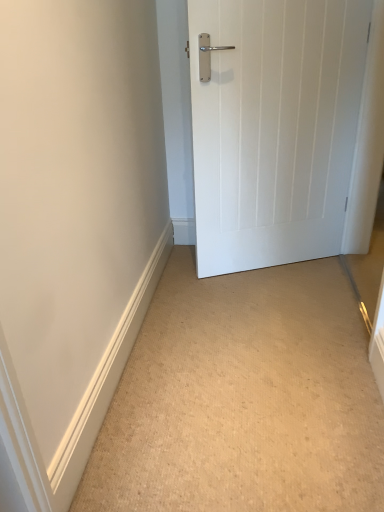
Describe the element at coordinates (274, 128) in the screenshot. I see `white wooden door at right` at that location.

Locate an element on the screen. white wooden door at right is located at coordinates (274, 128).

What do you see at coordinates (243, 398) in the screenshot? The height and width of the screenshot is (512, 384). I see `beige carpet at lower center` at bounding box center [243, 398].

What is the approximate width of beige carpet at lower center?

The width of beige carpet at lower center is 5.19 feet.

Find the location of a particular element. The width and height of the screenshot is (384, 512). beige carpet at lower center is located at coordinates (243, 398).

I want to click on white wooden door at right, so click(x=274, y=128).

Considering the positions of objects white wooden door at right and beige carpet at lower center in the image provided, who is more to the right, white wooden door at right or beige carpet at lower center?

Positioned to the right is white wooden door at right.

Considering the positions of objects white wooden door at right and beige carpet at lower center in the image provided, who is in front, white wooden door at right or beige carpet at lower center?

Positioned in front is beige carpet at lower center.

Does point (358, 73) lie in front of point (308, 377)?

No, it is behind (308, 377).

From the image's perspective, is white wooden door at right located above or below beige carpet at lower center?

white wooden door at right is above beige carpet at lower center.

From a real-world perspective, which is physically below, white wooden door at right or beige carpet at lower center?

beige carpet at lower center, from a real-world perspective.

From the picture: Does white wooden door at right have a greater width compared to beige carpet at lower center?

No, white wooden door at right is not wider than beige carpet at lower center.

Can you confirm if white wooden door at right is shorter than beige carpet at lower center?

No.

Is white wooden door at right smaller than beige carpet at lower center?

Incorrect, white wooden door at right is not smaller in size than beige carpet at lower center.

Is beige carpet at lower center inside white wooden door at right?

Actually, beige carpet at lower center is outside white wooden door at right.

Are white wooden door at right and beige carpet at lower center far apart?

No.

Could you tell me if white wooden door at right is turned towards beige carpet at lower center?

Yes, white wooden door at right is oriented towards beige carpet at lower center.

What are the coordinates of `door above the beige carpet at lower center (from a real-world perspective)` in the screenshot? It's located at (274, 128).

Is beige carpet at lower center to the right of white wooden door at right from the viewer's perspective?

Incorrect, beige carpet at lower center is not on the right side of white wooden door at right.

Is beige carpet at lower center in front of or behind white wooden door at right in the image?

Clearly, beige carpet at lower center is in front of white wooden door at right.

Does point (144, 456) come behind point (326, 18)?

No, it is in front of (326, 18).

From the image's perspective, which object appears higher, beige carpet at lower center or white wooden door at right?

white wooden door at right appears higher in the image.

From a real-world perspective, is beige carpet at lower center positioned over white wooden door at right based on gravity?

Actually, beige carpet at lower center is physically below white wooden door at right in the real world.

Which of these two, beige carpet at lower center or white wooden door at right, is thinner?

white wooden door at right is thinner.

Between beige carpet at lower center and white wooden door at right, which one has less height?

With less height is beige carpet at lower center.

Considering the sizes of objects beige carpet at lower center and white wooden door at right in the image provided, who is bigger, beige carpet at lower center or white wooden door at right?

white wooden door at right is bigger.

Choose the correct answer: Is beige carpet at lower center inside white wooden door at right or outside it?

beige carpet at lower center lies outside white wooden door at right.

Is beige carpet at lower center with white wooden door at right?

They are not placed beside each other.

Could you tell me if beige carpet at lower center is facing white wooden door at right?

No, beige carpet at lower center is not oriented towards white wooden door at right.

The image size is (384, 512). In order to click on corridor in front of the white wooden door at right in this screenshot , I will do `click(243, 398)`.

Locate an element on the screen. Image resolution: width=384 pixels, height=512 pixels. corridor on the left of white wooden door at right is located at coordinates (243, 398).

Identify the location of door that is on the right side of beige carpet at lower center. (274, 128).